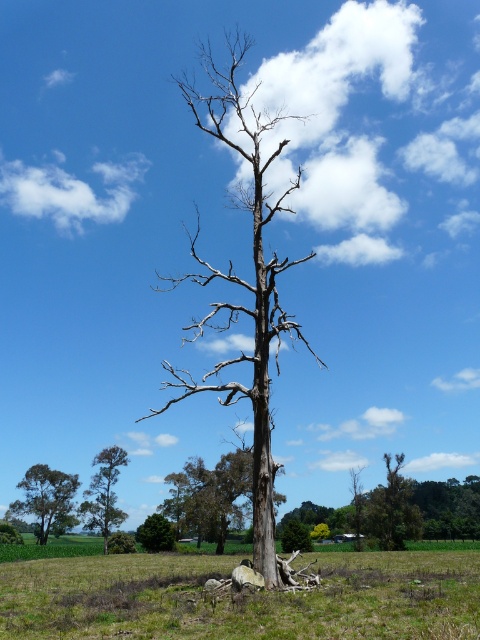
Based on the photo, can you confirm if green grass at center is positioned above green matte tree at lower left?

Yes.

Is point (278, 618) farther from camera compared to point (17, 513)?

No, it is in front of (17, 513).

Which is behind, point (468, 627) or point (61, 515)?

The point (61, 515) is more distant.

Identify the location of green grass at center. The image size is (480, 640). (240, 596).

Can you confirm if green grass at center is positioned to the left of green leafy tree at lower right?

Yes, green grass at center is to the left of green leafy tree at lower right.

Where is `green grass at center`? green grass at center is located at coordinates (240, 596).

Locate an element on the screen. green grass at center is located at coordinates (240, 596).

Can you confirm if green leafy tree at lower right is taller than green matte tree at lower center?

Yes, green leafy tree at lower right is taller than green matte tree at lower center.

Is point (364, 502) positioned behind point (143, 524)?

Yes, it is.

The image size is (480, 640). What are the coordinates of `green leafy tree at lower right` in the screenshot? It's located at (393, 508).